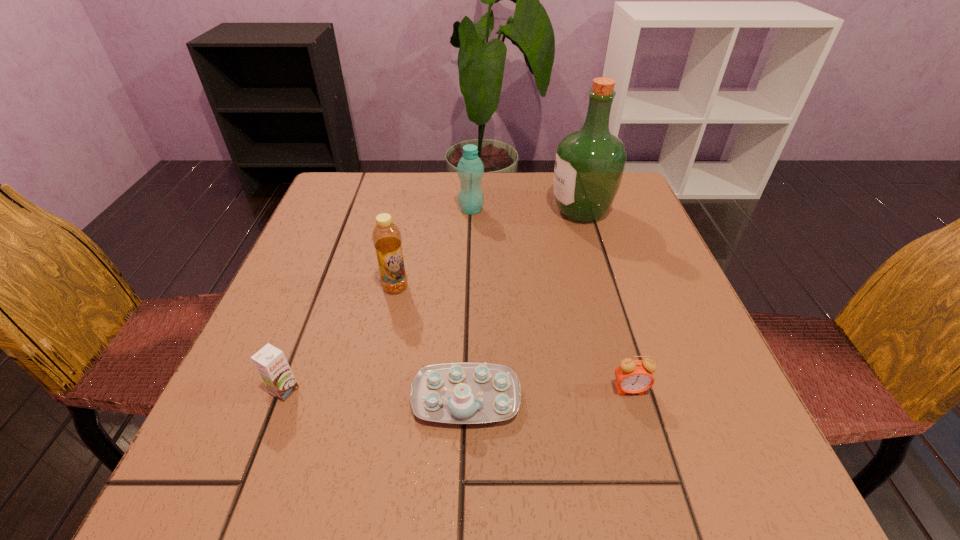
The height and width of the screenshot is (540, 960). I want to click on the tallest object, so click(589, 164).

Where is `the second object from left to right`? The height and width of the screenshot is (540, 960). the second object from left to right is located at coordinates (386, 236).

Identify the location of the nearer bottle. (386, 236).

Where is `the farther bottle`? the farther bottle is located at coordinates tap(470, 169).

Image resolution: width=960 pixels, height=540 pixels. I want to click on the leftmost object, so pyautogui.click(x=270, y=362).

Locate an element on the screen. Image resolution: width=960 pixels, height=540 pixels. the second shortest object is located at coordinates (633, 376).

Where is `the shortest object`? The height and width of the screenshot is (540, 960). the shortest object is located at coordinates (460, 393).

Where is `vacant space located on the front-facing side of the tallest object`? vacant space located on the front-facing side of the tallest object is located at coordinates (469, 212).

Where is `vacant region located 0.260m on the front-facing side of the tallest object`? This screenshot has height=540, width=960. vacant region located 0.260m on the front-facing side of the tallest object is located at coordinates (445, 212).

Locate an element on the screen. Image resolution: width=960 pixels, height=540 pixels. vacant space situated on the front-facing side of the tallest object is located at coordinates (514, 212).